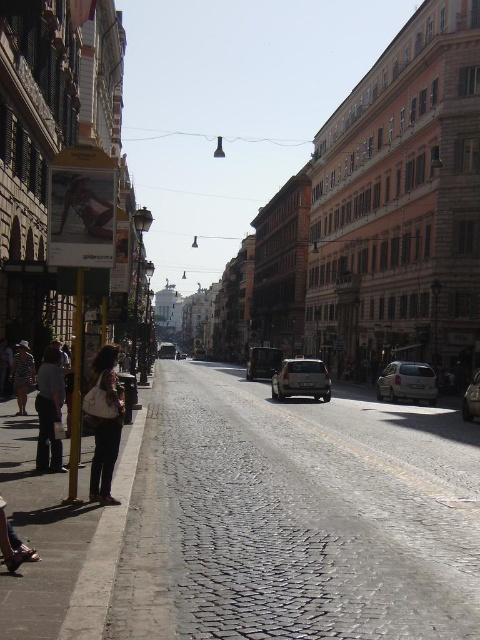
Can you confirm if beige fabric bikini at center is positioned below shiny black car at center?

Incorrect, beige fabric bikini at center is not positioned below shiny black car at center.

Between beige fabric bikini at center and shiny black car at center, which one has more height?

shiny black car at center is taller.

Is point (68, 172) in front of point (247, 365)?

Yes, it is in front of point (247, 365).

Where is `beige fabric bikini at center`? The width and height of the screenshot is (480, 640). beige fabric bikini at center is located at coordinates (82, 205).

Describe the element at coordinates (300, 380) in the screenshot. I see `satin silver suv at center` at that location.

Does satin silver suv at center have a smaller size compared to shiny black car at center?

Yes.

Is point (312, 387) positioned in front of point (259, 369)?

Yes, it is in front of point (259, 369).

This screenshot has height=640, width=480. In order to click on satin silver suv at center in this screenshot , I will do [x=300, y=380].

Does point (420, 381) come in front of point (251, 349)?

Yes, point (420, 381) is in front of point (251, 349).

Identify the location of white matte hatchback at center-right. (407, 381).

Does point (385, 384) lie in front of point (257, 371)?

Yes, point (385, 384) is closer to viewer.

Locate an element on the screen. This screenshot has width=480, height=640. white matte hatchback at center-right is located at coordinates (407, 381).